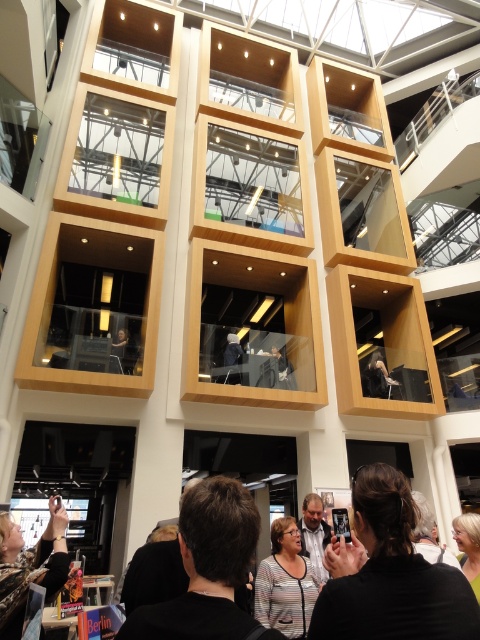
Can you confirm if black leather jacket at lower left is positioned above striped fabric shirt at center?

Yes, black leather jacket at lower left is above striped fabric shirt at center.

Who is positioned more to the right, black leather jacket at lower left or striped fabric shirt at center?

striped fabric shirt at center

Between point (43, 584) and point (289, 545), which one is positioned behind?

The point (289, 545) is more distant.

At what (x,y) coordinates should I click in order to perform the action: click on black leather jacket at lower left. Please return your answer as a coordinate pair (x, y). This screenshot has height=640, width=480. Looking at the image, I should click on (x=29, y=564).

Is dark brown hair at lower center positioned before gray striped shirt at center?

Yes, it is in front of gray striped shirt at center.

Does dark brown hair at lower center appear on the left side of gray striped shirt at center?

Yes, dark brown hair at lower center is to the left of gray striped shirt at center.

Is point (170, 576) closer to viewer compared to point (315, 570)?

Yes, it is.

Identify the location of dark brown hair at lower center. The width and height of the screenshot is (480, 640). (206, 570).

Does dark brown hair at lower center have a lesser height compared to striped fabric shirt at center?

No.

The height and width of the screenshot is (640, 480). I want to click on dark brown hair at lower center, so click(206, 570).

Image resolution: width=480 pixels, height=640 pixels. What do you see at coordinates (206, 570) in the screenshot?
I see `dark brown hair at lower center` at bounding box center [206, 570].

Locate an element on the screen. This screenshot has height=640, width=480. dark brown hair at lower center is located at coordinates (206, 570).